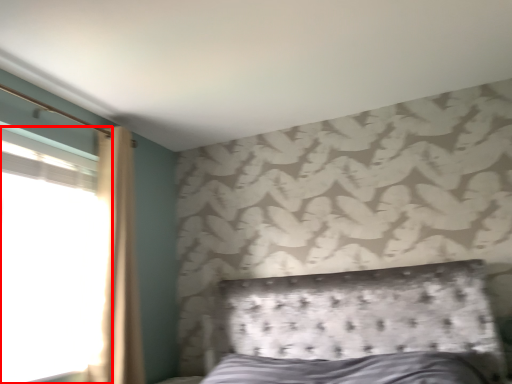
Question: Where is window (annotated by the red box) located in relation to curtain in the image?

Choices:
 (A) right
 (B) left

Answer: (B)